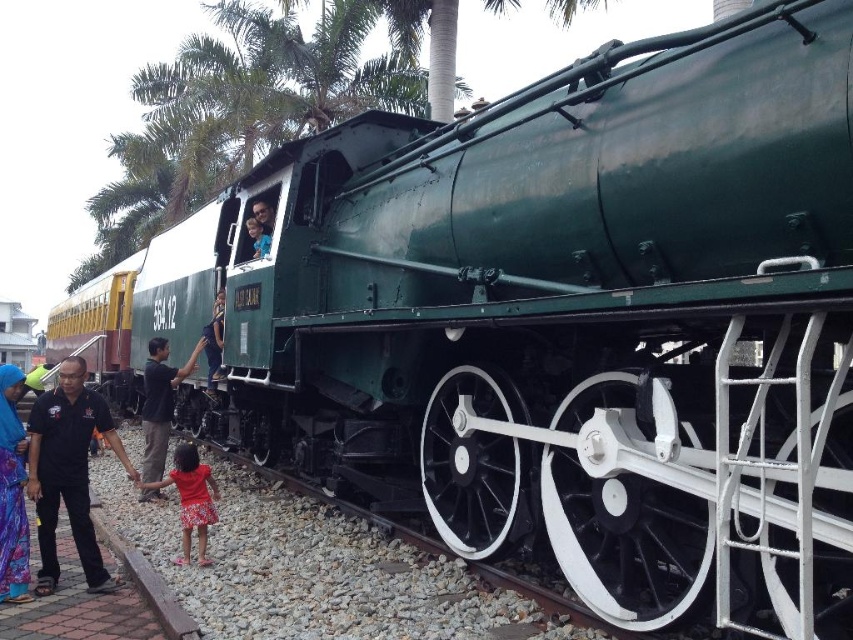
You are a photographer positioned at the back of the scene. You want to take a photo that includes both the black shirt at left and the red floral dress at lower left. Which object should you move closer to the camera to ensure both are visible in the frame?

The black shirt at left is already in front of the red floral dress at lower left, so you should move the red floral dress at lower left closer to the camera to ensure both are visible in the frame.

You are a maintenance worker responsible for checking the distance between two trains. You see the dark green metal train at center and the metallic green train at center in the scene. Can you fit a 15 inch tool box between them?

The dark green metal train at center and metallic green train at center are 18.65 inches apart from each other, so yes, the 15 inch tool box can fit between them since the distance is greater than the tool box length.